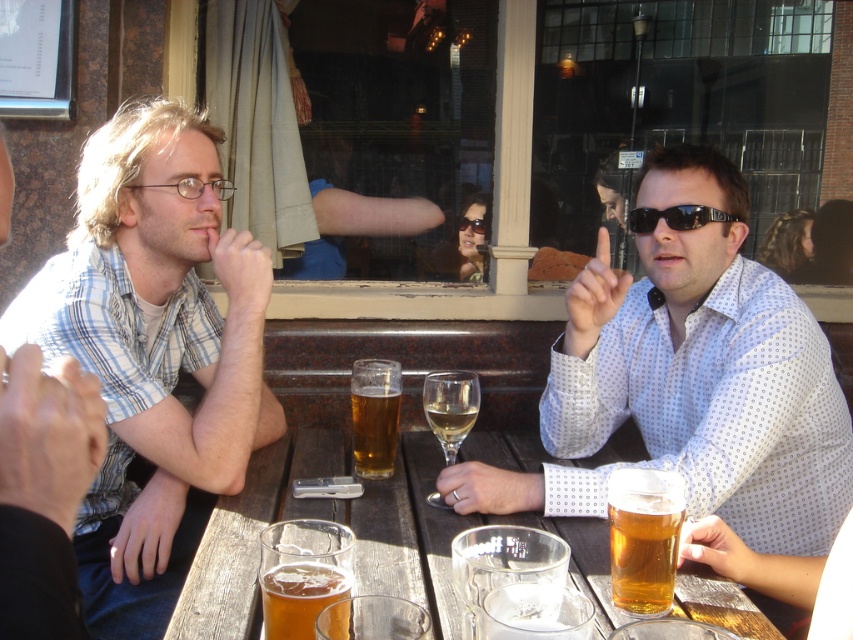
Question: Which point appears closest to the camera in this image?

Choices:
 (A) (431, 396)
 (B) (700, 225)
 (C) (791, 529)
 (D) (39, 300)

Answer: (D)

Question: Which point is farther from the camera taking this photo?

Choices:
 (A) (363, 380)
 (B) (532, 493)

Answer: (A)

Question: Is translucent glass mug at center above translucent glass wine at center?

Choices:
 (A) yes
 (B) no

Answer: (B)

Question: Among these objects, which one is farthest from the camera?

Choices:
 (A) translucent glass beer at center
 (B) golden glass beer at lower center
 (C) plaid shirt at left

Answer: (A)

Question: Does light blue plaid shirt at left appear on the left side of wooden table at center?

Choices:
 (A) no
 (B) yes

Answer: (B)

Question: Does translucent glass mug at center appear over translucent glass beer at center?

Choices:
 (A) no
 (B) yes

Answer: (A)